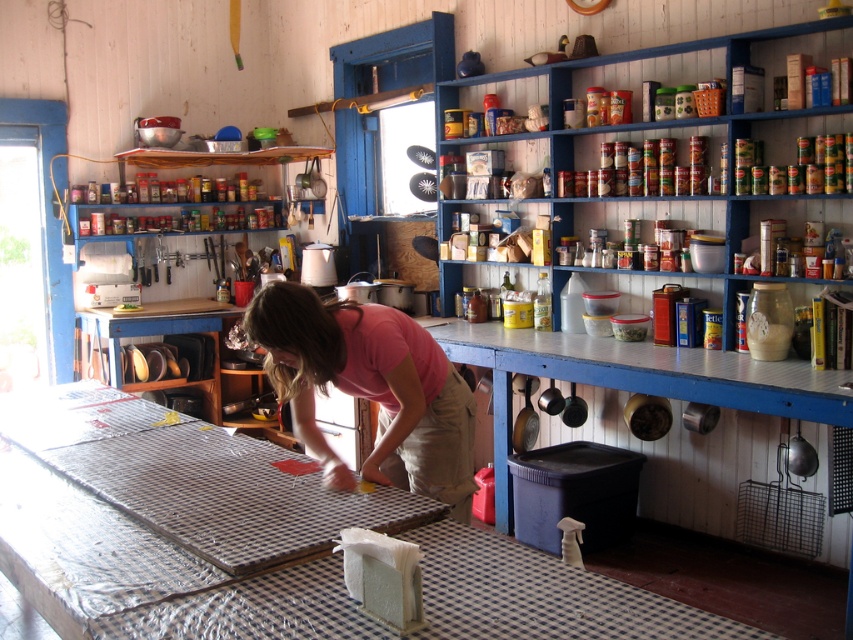
From the picture: Can you confirm if blue painted wood shelves at upper right is positioned above metallic cans at upper center?

Actually, blue painted wood shelves at upper right is below metallic cans at upper center.

Between blue painted wood shelves at upper right and metallic cans at upper center, which one has less height?

metallic cans at upper center

Which is behind, point (782, 148) or point (712, 122)?

The point (712, 122) is behind.

At what (x,y) coordinates should I click in order to perform the action: click on blue painted wood shelves at upper right. Please return your answer as a coordinate pair (x, y). The width and height of the screenshot is (853, 640). Looking at the image, I should click on (699, 227).

Can you confirm if checkered fabric workbench at center is positioned to the right of blue painted wood shelves at upper right?

In fact, checkered fabric workbench at center is to the left of blue painted wood shelves at upper right.

Between checkered fabric workbench at center and blue painted wood shelves at upper right, which one is positioned higher?

→ blue painted wood shelves at upper right is above.

What are the coordinates of `checkered fabric workbench at center` in the screenshot? It's located at tap(257, 540).

I want to click on checkered fabric workbench at center, so coord(257,540).

Image resolution: width=853 pixels, height=640 pixels. Describe the element at coordinates (257, 540) in the screenshot. I see `checkered fabric workbench at center` at that location.

Between point (440, 541) and point (664, 122), which one is positioned in front?

Point (440, 541) is in front.

Is point (675, 611) positioned behind point (680, 131)?

No, (675, 611) is in front of (680, 131).

Identify the location of checkered fabric workbench at center. (257, 540).